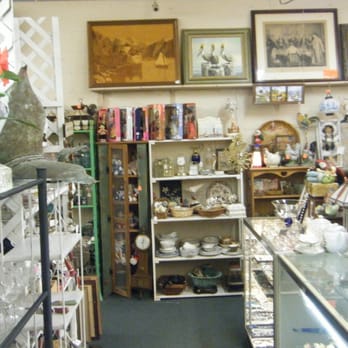
Where is `dish`? Image resolution: width=348 pixels, height=348 pixels. dish is located at coordinates (213, 283).